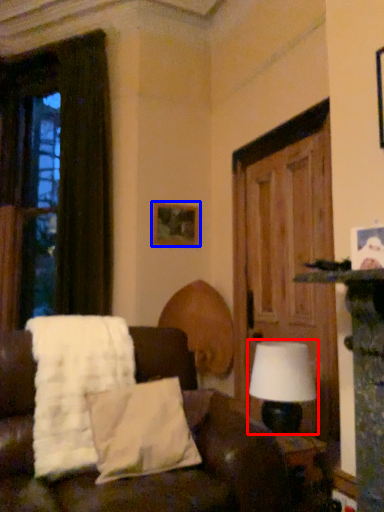
Question: Which point is closer to the camera, table lamp (highlighted by a red box) or picture frame (highlighted by a blue box)?

Choices:
 (A) table lamp
 (B) picture frame

Answer: (A)